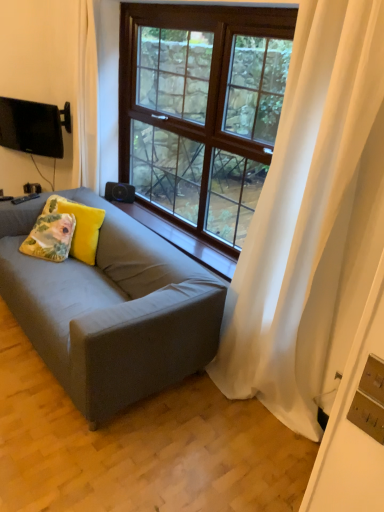
Question: Can you confirm if white sheer curtain at right is smaller than matte gray couch at center?

Choices:
 (A) no
 (B) yes

Answer: (B)

Question: Does white sheer curtain at right have a lesser width compared to matte gray couch at center?

Choices:
 (A) no
 (B) yes

Answer: (B)

Question: Does white sheer curtain at right have a larger size compared to matte gray couch at center?

Choices:
 (A) no
 (B) yes

Answer: (A)

Question: From a real-world perspective, is white sheer curtain at right positioned under matte gray couch at center based on gravity?

Choices:
 (A) no
 (B) yes

Answer: (A)

Question: From the image's perspective, is white sheer curtain at right under matte gray couch at center?

Choices:
 (A) no
 (B) yes

Answer: (A)

Question: From the image's perspective, is white sheer curtain at right on matte gray couch at center?

Choices:
 (A) no
 (B) yes

Answer: (B)

Question: Is wooden at center inside brown wooden window at center?

Choices:
 (A) no
 (B) yes

Answer: (A)

Question: Can you confirm if brown wooden window at center is positioned to the left of wooden at center?

Choices:
 (A) yes
 (B) no

Answer: (B)

Question: Is brown wooden window at center wider than wooden at center?

Choices:
 (A) no
 (B) yes

Answer: (A)

Question: Considering the relative sizes of brown wooden window at center and wooden at center in the image provided, is brown wooden window at center shorter than wooden at center?

Choices:
 (A) yes
 (B) no

Answer: (B)

Question: Is brown wooden window at center completely or partially outside of wooden at center?

Choices:
 (A) yes
 (B) no

Answer: (A)

Question: Considering the relative sizes of brown wooden window at center and wooden at center in the image provided, is brown wooden window at center taller than wooden at center?

Choices:
 (A) yes
 (B) no

Answer: (A)

Question: Considering the relative sizes of floral fabric cushion at center, the first pillow in the right-to-left sequence, and matte gray couch at center in the image provided, is floral fabric cushion at center, the first pillow in the right-to-left sequence, bigger than matte gray couch at center?

Choices:
 (A) yes
 (B) no

Answer: (B)